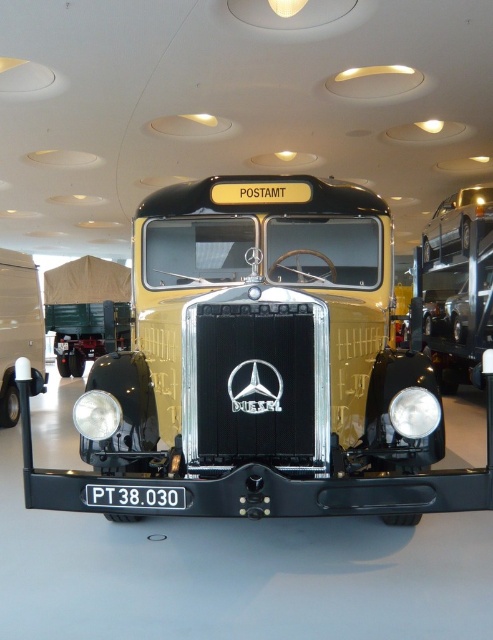
Question: Is black plastic license plate at center above matte silver headlight at center?

Choices:
 (A) yes
 (B) no

Answer: (B)

Question: Which of the following is the farthest from the observer?

Choices:
 (A) (418, 403)
 (B) (435, 246)

Answer: (B)

Question: Is black plastic license plate at center closer to the viewer compared to matte silver headlight at center?

Choices:
 (A) no
 (B) yes

Answer: (B)

Question: Does shiny silver car at upper right appear on the right side of black plastic license plate at center?

Choices:
 (A) yes
 (B) no

Answer: (A)

Question: Which point is closer to the camera?

Choices:
 (A) (91, 413)
 (B) (483, 204)
 (C) (162, 493)

Answer: (C)

Question: Considering the real-world distances, which object is farthest from the matte silver headlight at center?

Choices:
 (A) black plastic license plate at center
 (B) matte silver headlight at lower right

Answer: (B)